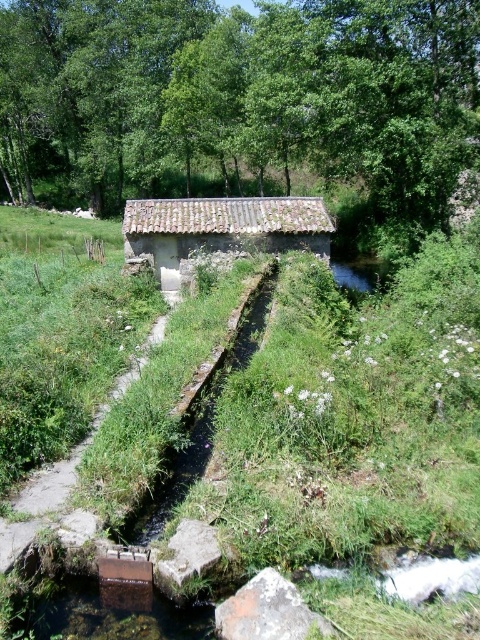
You are standing at the point marked as point [220,228] in the image. What object is exactly at this location?

The rusty metal hut at center is located at point [220,228].